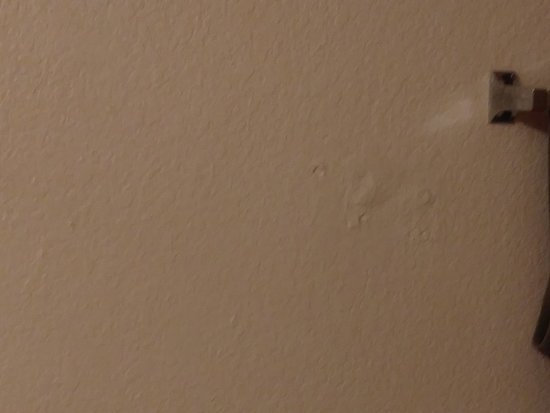
I want to click on sides of towel rack mount, so click(x=533, y=97), click(x=540, y=89), click(x=537, y=110), click(x=544, y=101).